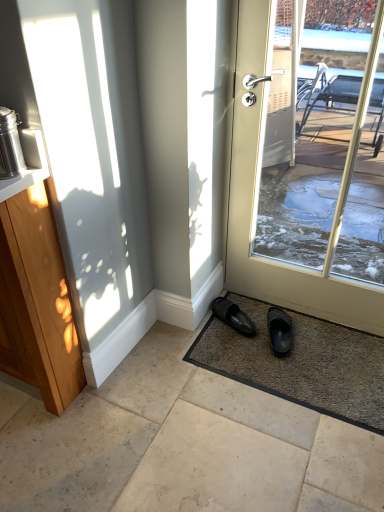
The height and width of the screenshot is (512, 384). In order to click on empty space that is in between black rubber slipper at lower center, marked as the first footwear in a left-to-right arrangement, and black rubber slipper at lower right, which appears as the second footwear when viewed from the left in this screenshot , I will do click(x=255, y=328).